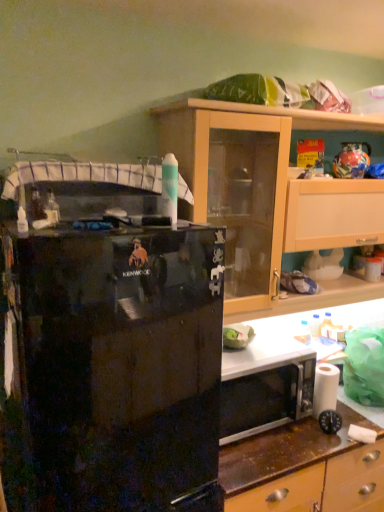
The width and height of the screenshot is (384, 512). What do you see at coordinates (113, 370) in the screenshot? I see `black glossy refrigerator at left` at bounding box center [113, 370].

Locate an element on the screen. This screenshot has width=384, height=512. light wood cabinet at upper right is located at coordinates (273, 186).

This screenshot has height=512, width=384. Identify the location of toilet paper behind the black glossy refrigerator at left. (325, 388).

Is black glossy refrigerator at left bigger or smaller than white matte toilet paper at lower right?

Clearly, black glossy refrigerator at left is larger in size than white matte toilet paper at lower right.

Who is taller, black glossy refrigerator at left or white matte toilet paper at lower right?

black glossy refrigerator at left is taller.

Is white matte toilet paper at lower right positioned behind black glossy refrigerator at left?

Yes.

I want to click on refrigerator above the white matte toilet paper at lower right (from a real-world perspective), so click(113, 370).

Between white matte toilet paper at lower right and black glossy refrigerator at left, which one has more height?

Standing taller between the two is black glossy refrigerator at left.

From a real-world perspective, is white matte toilet paper at lower right located higher than black glossy refrigerator at left?

No, from a real-world perspective, white matte toilet paper at lower right is not over black glossy refrigerator at left

What's the angular difference between black glossy refrigerator at left and light wood cabinet at upper right's facing directions?

There is a 0.000434-degree angle between the facing directions of black glossy refrigerator at left and light wood cabinet at upper right.

Does black glossy refrigerator at left contain light wood cabinet at upper right?

Actually, light wood cabinet at upper right is outside black glossy refrigerator at left.

Can you confirm if black glossy refrigerator at left is taller than light wood cabinet at upper right?

Indeed, black glossy refrigerator at left has a greater height compared to light wood cabinet at upper right.

How far apart are black glossy refrigerator at left and light wood cabinet at upper right?

black glossy refrigerator at left is 21.97 inches from light wood cabinet at upper right.

Considering the relative sizes of white matte toilet paper at lower right and light wood cabinet at upper right in the image provided, is white matte toilet paper at lower right smaller than light wood cabinet at upper right?

Yes, white matte toilet paper at lower right is smaller than light wood cabinet at upper right.

Identify the location of toilet paper behind the light wood cabinet at upper right. The height and width of the screenshot is (512, 384). (325, 388).

Does white matte toilet paper at lower right come in front of light wood cabinet at upper right?

No, the depth of white matte toilet paper at lower right is greater than that of light wood cabinet at upper right.

Between light wood cabinet at upper right and white matte toilet paper at lower right, which one appears on the left side from the viewer's perspective?

Positioned to the left is light wood cabinet at upper right.

Is light wood cabinet at upper right wider or thinner than white matte toilet paper at lower right?

Considering their sizes, light wood cabinet at upper right looks broader than white matte toilet paper at lower right.

Find the location of a particular element. toilet paper below the light wood cabinet at upper right (from the image's perspective) is located at coordinates (325, 388).

Which object is positioned more to the right, light wood cabinet at upper right or black glossy refrigerator at left?

From the viewer's perspective, light wood cabinet at upper right appears more on the right side.

Would you say light wood cabinet at upper right is a long distance from black glossy refrigerator at left?

No, light wood cabinet at upper right is in close proximity to black glossy refrigerator at left.

The width and height of the screenshot is (384, 512). Find the location of `cabinetry above the black glossy refrigerator at left (from the image's perspective)`. cabinetry above the black glossy refrigerator at left (from the image's perspective) is located at coordinates (273, 186).

Considering the points (301, 186) and (70, 233), which point is in front, point (301, 186) or point (70, 233)?

The point (70, 233) is in front.

Identify the location of refrigerator above the white matte toilet paper at lower right (from a real-world perspective). This screenshot has width=384, height=512. 113,370.

Where is `refrigerator in front of the white matte toilet paper at lower right`? The width and height of the screenshot is (384, 512). refrigerator in front of the white matte toilet paper at lower right is located at coordinates (113, 370).

From the image, which object appears to be nearer to white matte toilet paper at lower right, black glossy refrigerator at left or light wood cabinet at upper right?

light wood cabinet at upper right.

Based on the photo, from the image, which object appears to be nearer to light wood cabinet at upper right, white matte toilet paper at lower right or black glossy refrigerator at left?

black glossy refrigerator at left is positioned closer to the anchor light wood cabinet at upper right.

Based on the photo, which object lies nearer to the anchor point black glossy refrigerator at left, white matte toilet paper at lower right or light wood cabinet at upper right?

The object closer to black glossy refrigerator at left is light wood cabinet at upper right.

Which object lies nearer to the anchor point black glossy refrigerator at left, light wood cabinet at upper right or white matte toilet paper at lower right?

The object closer to black glossy refrigerator at left is light wood cabinet at upper right.

Based on their spatial positions, is black glossy refrigerator at left or white matte toilet paper at lower right closer to light wood cabinet at upper right?

The object closer to light wood cabinet at upper right is black glossy refrigerator at left.

Considering their positions, is light wood cabinet at upper right positioned further to white matte toilet paper at lower right than black glossy refrigerator at left?

Based on the image, black glossy refrigerator at left appears to be further to white matte toilet paper at lower right.

At what (x,y) coordinates should I click in order to perform the action: click on cabinetry between black glossy refrigerator at left and white matte toilet paper at lower right. Please return your answer as a coordinate pair (x, y). The width and height of the screenshot is (384, 512). Looking at the image, I should click on (273, 186).